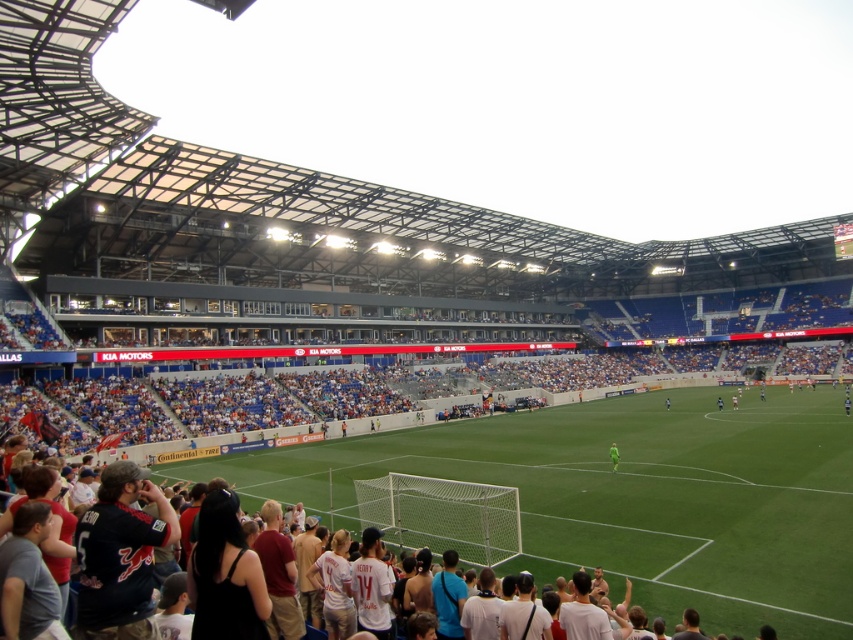
Who is shorter, green grass football field at lower center or green jersey at center?

Standing shorter between the two is green jersey at center.

Is the position of green grass football field at lower center more distant than that of green jersey at center?

No, it is in front of green jersey at center.

Image resolution: width=853 pixels, height=640 pixels. Find the location of `green grass football field at lower center`. green grass football field at lower center is located at coordinates (631, 497).